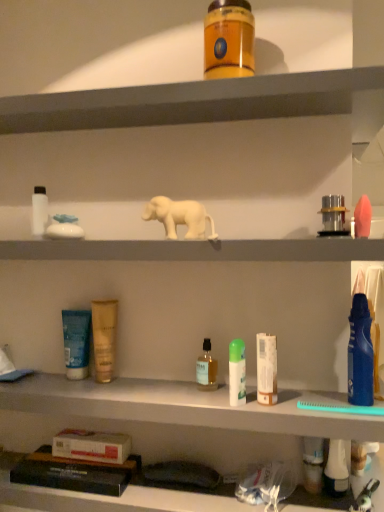
Question: Is white matte bottle at left, the first toiletry viewed from the left, shorter than translucent plastic cup at lower right, arranged as the fifth toiletry when viewed from the right?

Choices:
 (A) no
 (B) yes

Answer: (B)

Question: Is white matte bottle at left, marked as the 12th toiletry in a right-to-left arrangement, not close to translucent plastic cup at lower right, positioned as the eighth toiletry in left-to-right order?

Choices:
 (A) no
 (B) yes

Answer: (A)

Question: Considering the relative sizes of white matte bottle at left, marked as the 12th toiletry in a right-to-left arrangement, and translucent plastic cup at lower right, arranged as the fifth toiletry when viewed from the right, in the image provided, is white matte bottle at left, marked as the 12th toiletry in a right-to-left arrangement, smaller than translucent plastic cup at lower right, arranged as the fifth toiletry when viewed from the right,?

Choices:
 (A) no
 (B) yes

Answer: (B)

Question: Is white matte bottle at left, the first toiletry viewed from the left, wider than translucent plastic cup at lower right, positioned as the eighth toiletry in left-to-right order?

Choices:
 (A) no
 (B) yes

Answer: (B)

Question: From the image's perspective, is white matte bottle at left, marked as the 12th toiletry in a right-to-left arrangement, over translucent plastic cup at lower right, positioned as the eighth toiletry in left-to-right order?

Choices:
 (A) no
 (B) yes

Answer: (B)

Question: Is white matte bottle at left, the first toiletry viewed from the left, to the left of translucent plastic cup at lower right, positioned as the eighth toiletry in left-to-right order, from the viewer's perspective?

Choices:
 (A) yes
 (B) no

Answer: (A)

Question: Is blue matte tube at middle left, the second toiletry when ordered from left to right, positioned in front of green matte spray can at center, acting as the sixth toiletry starting from the left?

Choices:
 (A) yes
 (B) no

Answer: (B)

Question: Considering the relative sizes of blue matte tube at middle left, which is counted as the eleventh toiletry, starting from the right, and green matte spray can at center, positioned as the 7th toiletry in right-to-left order, in the image provided, is blue matte tube at middle left, which is counted as the eleventh toiletry, starting from the right, thinner than green matte spray can at center, positioned as the 7th toiletry in right-to-left order,?

Choices:
 (A) yes
 (B) no

Answer: (A)

Question: From the image's perspective, is blue matte tube at middle left, the second toiletry when ordered from left to right, located beneath green matte spray can at center, positioned as the 7th toiletry in right-to-left order?

Choices:
 (A) yes
 (B) no

Answer: (B)

Question: Does blue matte tube at middle left, which is counted as the eleventh toiletry, starting from the right, appear on the right side of green matte spray can at center, acting as the sixth toiletry starting from the left?

Choices:
 (A) yes
 (B) no

Answer: (B)

Question: Is blue matte tube at middle left, which is counted as the eleventh toiletry, starting from the right, positioned with its back to green matte spray can at center, acting as the sixth toiletry starting from the left?

Choices:
 (A) yes
 (B) no

Answer: (B)

Question: From a real-world perspective, does blue matte tube at middle left, the second toiletry when ordered from left to right, stand above green matte spray can at center, positioned as the 7th toiletry in right-to-left order?

Choices:
 (A) no
 (B) yes

Answer: (B)

Question: From the image's perspective, does pink matte sponge at right, the first toiletry in the right-to-left sequence, appear lower than metallic silver canister at upper right, the 9th toiletry when ordered from left to right?

Choices:
 (A) yes
 (B) no

Answer: (A)